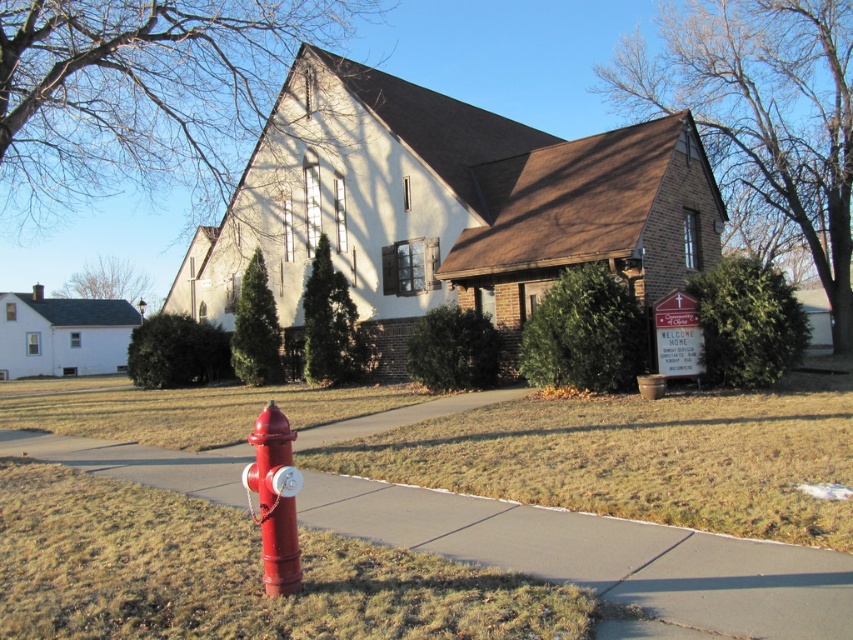
Between point (454, 547) and point (262, 420), which one is positioned in front?

Point (262, 420) is more forward.

Between point (209, 461) and point (273, 456), which one is positioned behind?

The point (209, 461) is behind.

Locate an element on the screen. The height and width of the screenshot is (640, 853). smooth concrete pavement at lower center is located at coordinates (607, 560).